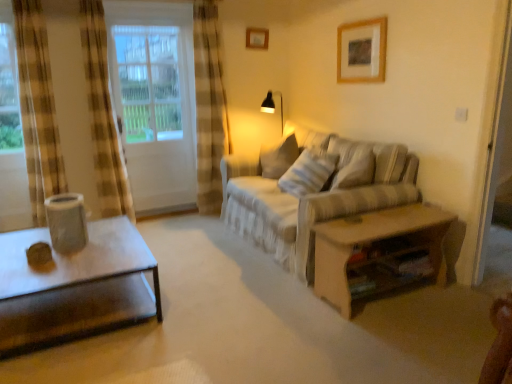
This screenshot has height=384, width=512. Find the location of `free location in front of wooden table at right`. free location in front of wooden table at right is located at coordinates (397, 341).